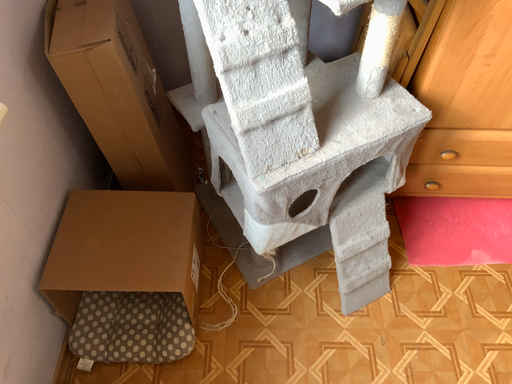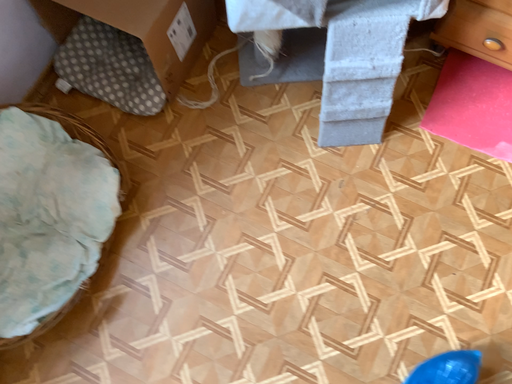
Question: How did the camera likely rotate when shooting the video?

Choices:
 (A) rotated upward
 (B) rotated downward

Answer: (B)